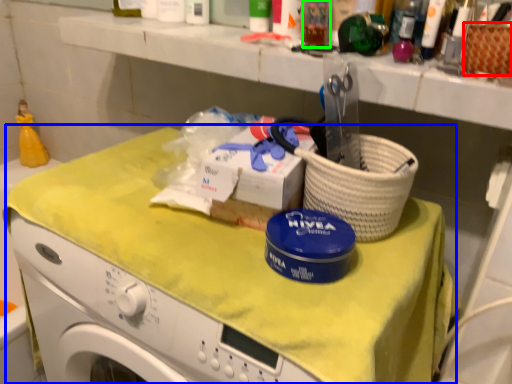
Question: Estimate the real-world distances between objects in this image. Which object is farther from basket (highlighted by a red box), counter (highlighted by a blue box) or toiletry (highlighted by a green box)?

Choices:
 (A) counter
 (B) toiletry

Answer: (A)